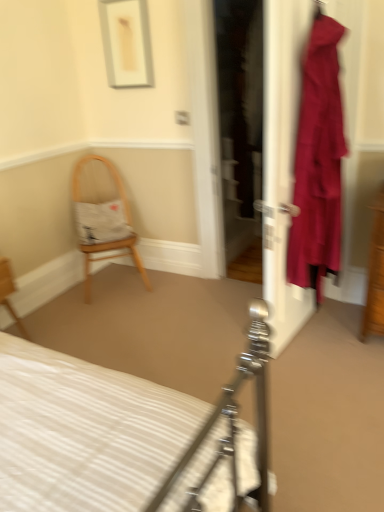
The height and width of the screenshot is (512, 384). Describe the element at coordinates (282, 160) in the screenshot. I see `matte white door at right` at that location.

Locate an element on the screen. wooden chair at lower left, placed as the 2th chair when sorted from back to front is located at coordinates (9, 293).

Find the location of a particular element. The height and width of the screenshot is (512, 384). matte white door at right is located at coordinates (282, 160).

Which of these two, wooden chair with cushion at left, the 1th chair viewed from the right, or white striped fabric bed at center, stands taller?

Standing taller between the two is white striped fabric bed at center.

Considering the positions of objects wooden chair with cushion at left, the 1th chair viewed from the right, and white striped fabric bed at center in the image provided, who is in front, wooden chair with cushion at left, the 1th chair viewed from the right, or white striped fabric bed at center?

white striped fabric bed at center is more forward.

The width and height of the screenshot is (384, 512). Identify the location of the 1st chair to the left when counting from the white striped fabric bed at center. (108, 214).

From the picture: Between wooden chair with cushion at left, the second chair viewed from the left, and white striped fabric bed at center, which one has smaller width?

Thinner between the two is wooden chair with cushion at left, the second chair viewed from the left.

In the scene shown: From the image's perspective, is wooden chair at lower left, which ranks as the first chair in front-to-back order, on wooden chair with cushion at left, the 1th chair viewed from the back?

No, from the image's perspective, wooden chair at lower left, which ranks as the first chair in front-to-back order, is not on top of wooden chair with cushion at left, the 1th chair viewed from the back.

Is wooden chair at lower left, which is the first chair in left-to-right order, positioned beyond the bounds of wooden chair with cushion at left, the second chair viewed from the left?

Yes, wooden chair at lower left, which is the first chair in left-to-right order, is outside of wooden chair with cushion at left, the second chair viewed from the left.

Is wooden chair at lower left, which is the first chair in left-to-right order, at the left side of wooden chair with cushion at left, the second chair viewed from the left?

Indeed, wooden chair at lower left, which is the first chair in left-to-right order, is positioned on the left side of wooden chair with cushion at left, the second chair viewed from the left.

Does velvet-like burgundy dress at right have a greater width compared to matte white door at right?

Correct, the width of velvet-like burgundy dress at right exceeds that of matte white door at right.

Which is more to the left, velvet-like burgundy dress at right or matte white door at right?

Positioned to the left is matte white door at right.

Locate an element on the screen. The width and height of the screenshot is (384, 512). clothing above the matte white door at right (from a real-world perspective) is located at coordinates (318, 162).

Is point (316, 166) less distant than point (307, 10)?

No, (316, 166) is further to viewer.

In the image, is wooden chair with cushion at left, the second chair viewed from the left, positioned in front of or behind wooden chair at lower left, which is the first chair in left-to-right order?

In the image, wooden chair with cushion at left, the second chair viewed from the left, appears behind wooden chair at lower left, which is the first chair in left-to-right order.

Which of these two, wooden chair with cushion at left, the 1th chair viewed from the right, or wooden chair at lower left, which is the first chair in left-to-right order, stands shorter?

With less height is wooden chair at lower left, which is the first chair in left-to-right order.

Is wooden chair with cushion at left, the 1th chair viewed from the right, not close to wooden chair at lower left, which is the first chair in left-to-right order?

wooden chair with cushion at left, the 1th chair viewed from the right, is actually quite close to wooden chair at lower left, which is the first chair in left-to-right order.

Measure the distance from wooden chair with cushion at left, the 1th chair viewed from the right, to wooden chair at lower left, placed as the 2th chair when sorted from back to front.

wooden chair with cushion at left, the 1th chair viewed from the right, is 88.61 centimeters from wooden chair at lower left, placed as the 2th chair when sorted from back to front.

Can you confirm if wooden chair with cushion at left, the 1th chair viewed from the right, is bigger than matte white door at right?

Yes.

Consider the image. Considering the relative sizes of wooden chair with cushion at left, the 1th chair viewed from the back, and matte white door at right in the image provided, is wooden chair with cushion at left, the 1th chair viewed from the back, wider than matte white door at right?

Indeed, wooden chair with cushion at left, the 1th chair viewed from the back, has a greater width compared to matte white door at right.

Is wooden chair with cushion at left, the second chair viewed from the front, turned away from matte white door at right?

No, wooden chair with cushion at left, the second chair viewed from the front, is not facing away from matte white door at right.

Is white striped fabric bed at center turned away from matte white door at right?

No, white striped fabric bed at center is not facing the opposite direction of matte white door at right.

Can you tell me how much white striped fabric bed at center and matte white door at right differ in facing direction?

They differ by 173 degrees in their facing directions.

Locate an element on the screen. The image size is (384, 512). bed in front of the matte white door at right is located at coordinates (125, 435).

Is white striped fabric bed at center placed right next to matte white door at right?

No, white striped fabric bed at center is not beside matte white door at right.

From the image's perspective, is matte white door at right located above wooden chair at lower left, which ranks as the 2th chair in right-to-left order?

Yes, from the image's perspective, matte white door at right is above wooden chair at lower left, which ranks as the 2th chair in right-to-left order.

What's the angular difference between matte white door at right and wooden chair at lower left, which ranks as the first chair in front-to-back order,'s facing directions?

170 degrees separate the facing orientations of matte white door at right and wooden chair at lower left, which ranks as the first chair in front-to-back order.

Is matte white door at right turned away from wooden chair at lower left, placed as the 2th chair when sorted from back to front?

No, matte white door at right is not facing away from wooden chair at lower left, placed as the 2th chair when sorted from back to front.

Between point (288, 14) and point (3, 267), which one is positioned in front?

The point (288, 14) is closer to the camera.

Where is `chair that is the 1st one below the white striped fabric bed at center (from a real-world perspective)`? This screenshot has height=512, width=384. chair that is the 1st one below the white striped fabric bed at center (from a real-world perspective) is located at coordinates (108, 214).

The width and height of the screenshot is (384, 512). In order to click on chair in front of the wooden chair with cushion at left, the second chair viewed from the front in this screenshot , I will do `click(9, 293)`.

From the image, which object appears to be farther from white striped fabric bed at center, velvet-like burgundy dress at right or matte white door at right?

velvet-like burgundy dress at right.

From the picture: Based on their spatial positions, is wooden chair at lower left, which ranks as the 2th chair in right-to-left order, or wooden chair with cushion at left, the 1th chair viewed from the right, closer to velvet-like burgundy dress at right?

wooden chair with cushion at left, the 1th chair viewed from the right, is positioned closer to the anchor velvet-like burgundy dress at right.

Estimate the real-world distances between objects in this image. Which object is closer to wooden chair at lower left, which is the first chair in left-to-right order, velvet-like burgundy dress at right or matte white door at right?

matte white door at right lies closer to wooden chair at lower left, which is the first chair in left-to-right order, than the other object.

Looking at the image, which one is located closer to velvet-like burgundy dress at right, wooden chair with cushion at left, the 1th chair viewed from the right, or white striped fabric bed at center?

white striped fabric bed at center.

Looking at the image, which one is located closer to wooden chair at lower left, which is the first chair in left-to-right order, white striped fabric bed at center or matte white door at right?

white striped fabric bed at center lies closer to wooden chair at lower left, which is the first chair in left-to-right order, than the other object.

Considering their positions, is matte white door at right positioned further to wooden chair at lower left, placed as the 2th chair when sorted from back to front, than velvet-like burgundy dress at right?

velvet-like burgundy dress at right lies further to wooden chair at lower left, placed as the 2th chair when sorted from back to front, than the other object.

Looking at the image, which one is located closer to white striped fabric bed at center, velvet-like burgundy dress at right or wooden chair at lower left, which is the first chair in left-to-right order?

velvet-like burgundy dress at right lies closer to white striped fabric bed at center than the other object.

In the scene shown: Based on their spatial positions, is matte white door at right or white striped fabric bed at center closer to velvet-like burgundy dress at right?

matte white door at right.

Find the location of a particular element. The height and width of the screenshot is (512, 384). clothing between white striped fabric bed at center and wooden chair at lower left, which ranks as the first chair in front-to-back order, along the z-axis is located at coordinates (318, 162).

At what (x,y) coordinates should I click in order to perform the action: click on door between white striped fabric bed at center and wooden chair at lower left, which ranks as the first chair in front-to-back order, from front to back. Please return your answer as a coordinate pair (x, y). The width and height of the screenshot is (384, 512). Looking at the image, I should click on (282, 160).

Locate an element on the screen. chair located between wooden chair at lower left, which ranks as the 2th chair in right-to-left order, and velvet-like burgundy dress at right in the left-right direction is located at coordinates (108, 214).

Where is `clothing between white striped fabric bed at center and wooden chair with cushion at left, the 1th chair viewed from the back, in the front-back direction`? clothing between white striped fabric bed at center and wooden chair with cushion at left, the 1th chair viewed from the back, in the front-back direction is located at coordinates (318, 162).